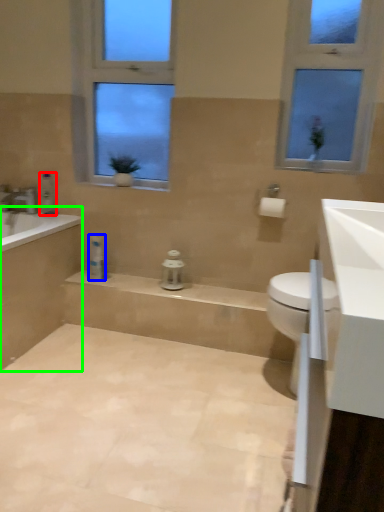
Question: Estimate the real-world distances between objects in this image. Which object is closer to toiletry (highlighted by a red box), toiletry (highlighted by a blue box) or bath (highlighted by a green box)?

Choices:
 (A) toiletry
 (B) bath

Answer: (A)